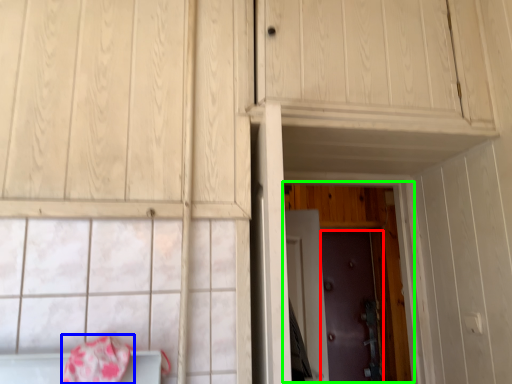
Question: Which object is positioned farthest from door (highlighted by a red box)? Select from blanket (highlighted by a blue box) and door (highlighted by a green box).

Choices:
 (A) blanket
 (B) door

Answer: (A)